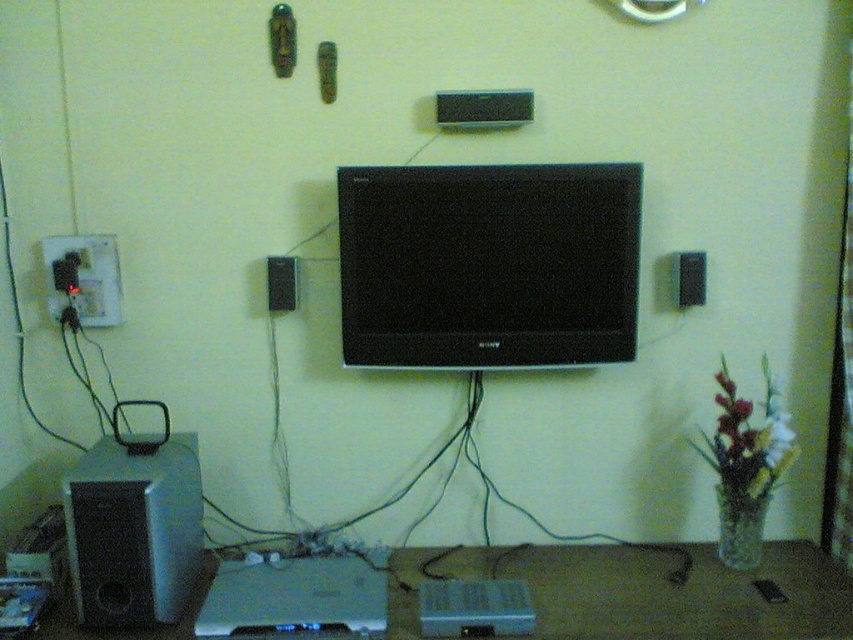
What do you see at coordinates (488, 264) in the screenshot? The width and height of the screenshot is (853, 640). I see `black glossy flat screen tv at center` at bounding box center [488, 264].

Who is positioned more to the left, black glossy flat screen tv at center or silver metallic speaker at lower left?

silver metallic speaker at lower left is more to the left.

The width and height of the screenshot is (853, 640). What do you see at coordinates (488, 264) in the screenshot? I see `black glossy flat screen tv at center` at bounding box center [488, 264].

You are a GUI agent. You are given a task and a screenshot of the screen. Output one action in this format:
    pyautogui.click(x=<x>, y=<y>)
    Task: Click on the black glossy flat screen tv at center
    This screenshot has height=640, width=853.
    Given the screenshot: What is the action you would take?
    pyautogui.click(x=488, y=264)

Is black glossy flat screen tv at center further to the viewer compared to black matte speaker at upper center?

No, it is not.

Can you confirm if black glossy flat screen tv at center is positioned below black matte speaker at upper center?

Yes.

Describe the element at coordinates (488, 264) in the screenshot. The image size is (853, 640). I see `black glossy flat screen tv at center` at that location.

In order to click on black glossy flat screen tv at center in this screenshot , I will do `click(488, 264)`.

Does brown wooden table at lower center have a lesser height compared to black matte speaker at upper center?

Incorrect, brown wooden table at lower center's height does not fall short of black matte speaker at upper center's.

Is brown wooden table at lower center positioned at the back of black matte speaker at upper center?

That is False.

Locate an element on the screen. brown wooden table at lower center is located at coordinates (643, 592).